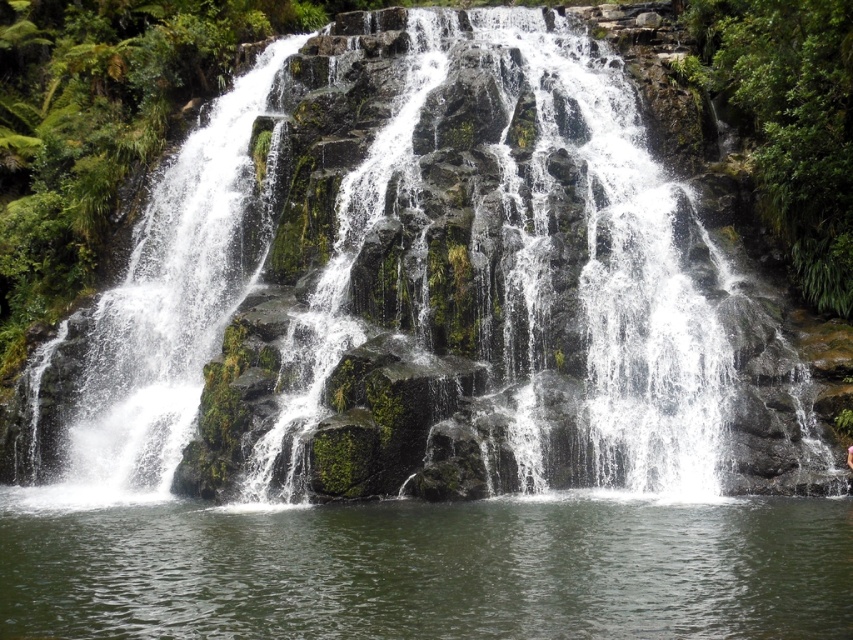
You are standing at the top of the waterfall and looking down. There is a point marked at coordinates (431, 570). What is located at that point?

The point at coordinates (431, 570) corresponds to clear water at the bottom of the waterfall.

You are standing at the edge of the waterfall and see the clear water at bottom and the pink fabric at center. Which object is positioned to the left when viewed from your perspective?

The clear water at bottom is to the left of the pink fabric at center.